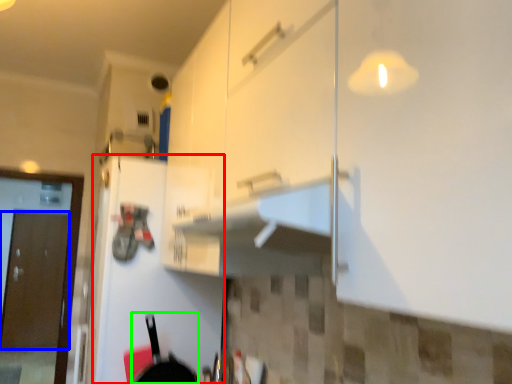
Question: Which object is the closest to the door (highlighted by a red box)? Choose among these: door (highlighted by a blue box) or frying pan (highlighted by a green box).

Choices:
 (A) door
 (B) frying pan

Answer: (B)